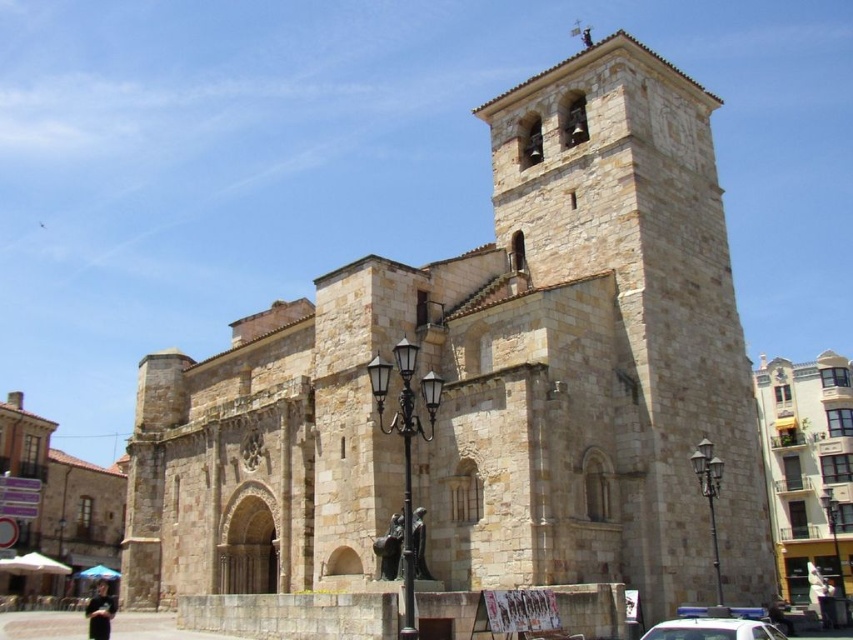
You are standing in front of the beige stone church at center and the white plastic car at center. Which object is positioned higher relative to the other?

The beige stone church at center is positioned higher than the white plastic car at center.

You are a visitor standing in front of the beige stone church at center and the white plastic car at center. You want to take a photo of both objects together in the frame. Which object should you zoom in on to ensure both fit in the photo?

You should zoom in on the white plastic car at center because the beige stone church at center is wider, so zooming in on the smaller object allows both to fit in the frame.